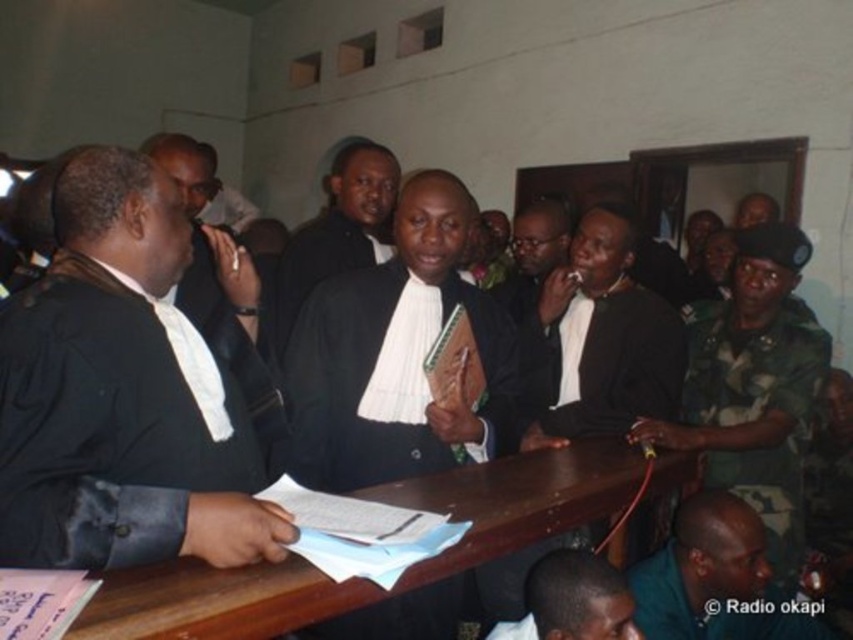
In the scene shown: You are an observer in the courtroom scene. You notice the dark green uniform at lower right and the white textured robe at center. Which of these two items is closer to you?

The dark green uniform at lower right is closer to you because it is in front of the white textured robe at center.

You are a person with a height of 1.8 meters. You are standing at point A, which is at coordinates point A at (234, 515). There is a table at point B, which is 1.07 meters away from you. Can you reach the table without moving your feet?

The distance between you and the table is 1.07 meters. Since you are 1.8 meters tall, you can easily reach the table without moving your feet as your arm length combined with your height surpasses the distance.